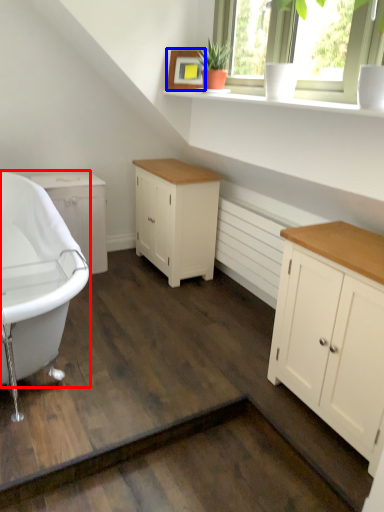
Question: Which object appears closest to the camera in this image, bathtub (highlighted by a red box) or picture frame (highlighted by a blue box)?

Choices:
 (A) bathtub
 (B) picture frame

Answer: (A)